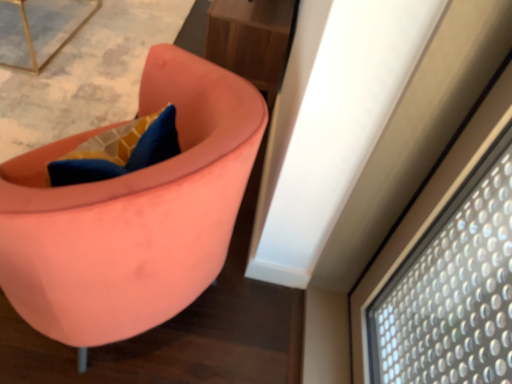
Question: From the image's perspective, does metallic gold table at upper left appear lower than wooden table at upper center?

Choices:
 (A) yes
 (B) no

Answer: (B)

Question: Considering the relative sizes of metallic gold table at upper left and wooden table at upper center in the image provided, is metallic gold table at upper left bigger than wooden table at upper center?

Choices:
 (A) no
 (B) yes

Answer: (A)

Question: Is the depth of metallic gold table at upper left less than that of wooden table at upper center?

Choices:
 (A) no
 (B) yes

Answer: (B)

Question: From the image's perspective, is metallic gold table at upper left on wooden table at upper center?

Choices:
 (A) no
 (B) yes

Answer: (B)

Question: Is metallic gold table at upper left not close to wooden table at upper center?

Choices:
 (A) yes
 (B) no

Answer: (A)

Question: Are metallic gold table at upper left and wooden table at upper center beside each other?

Choices:
 (A) no
 (B) yes

Answer: (A)

Question: Is matte pink chair at center positioned in front of metallic gold table at upper left?

Choices:
 (A) no
 (B) yes

Answer: (B)

Question: Is matte pink chair at center shorter than metallic gold table at upper left?

Choices:
 (A) no
 (B) yes

Answer: (B)

Question: Does matte pink chair at center appear on the left side of metallic gold table at upper left?

Choices:
 (A) no
 (B) yes

Answer: (A)

Question: From the image's perspective, is matte pink chair at center beneath metallic gold table at upper left?

Choices:
 (A) yes
 (B) no

Answer: (A)

Question: Is matte pink chair at center facing away from metallic gold table at upper left?

Choices:
 (A) no
 (B) yes

Answer: (A)

Question: Is matte pink chair at center not within metallic gold table at upper left?

Choices:
 (A) no
 (B) yes

Answer: (B)

Question: Can you confirm if wooden table at upper center is bigger than matte pink chair at center?

Choices:
 (A) yes
 (B) no

Answer: (B)